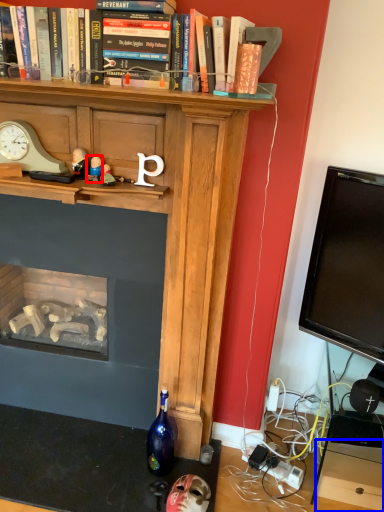
Question: Which object appears closest to the camera in this image, toy (highlighted by a red box) or drawer (highlighted by a blue box)?

Choices:
 (A) toy
 (B) drawer

Answer: (A)